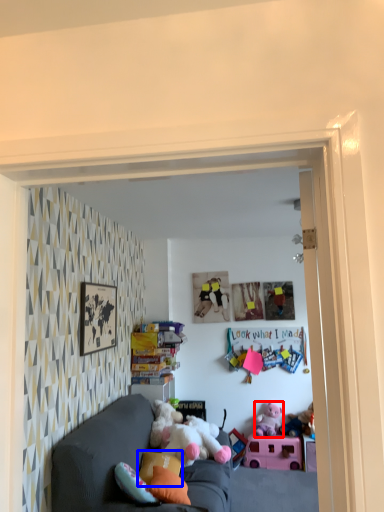
Question: Which point is further to the camera, toy (highlighted by a red box) or pillow (highlighted by a blue box)?

Choices:
 (A) toy
 (B) pillow

Answer: (A)